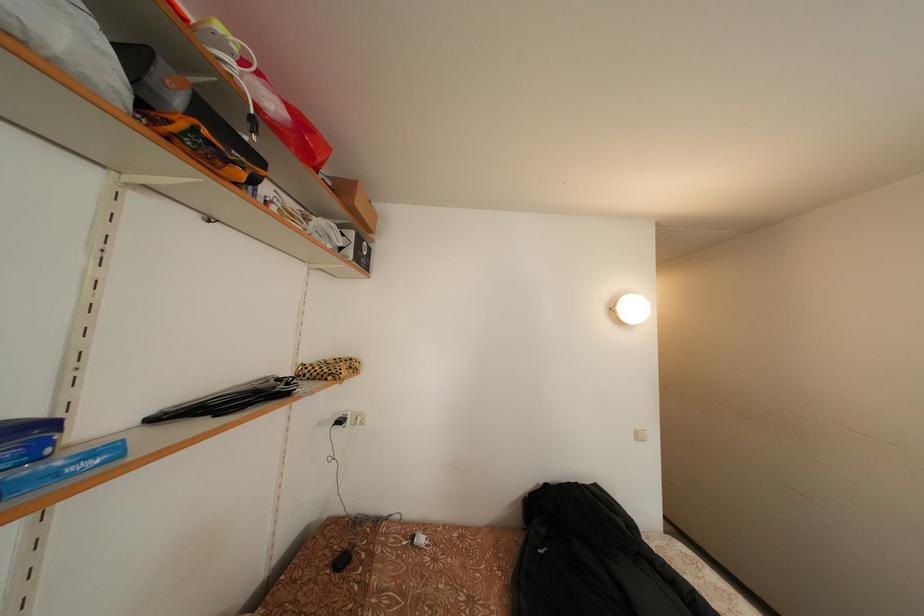
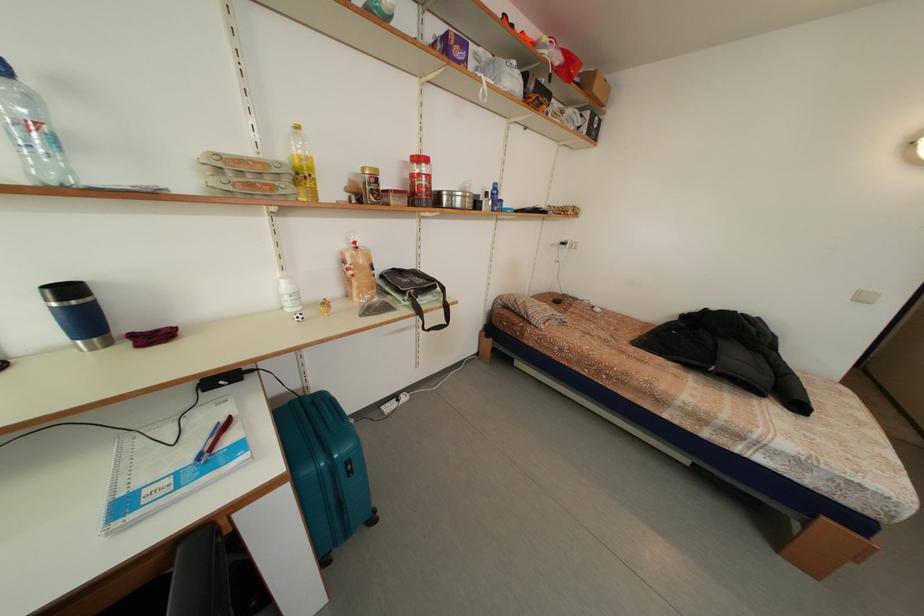
In the second image, find the point that corresponds to [368,209] in the first image.

(603, 95)